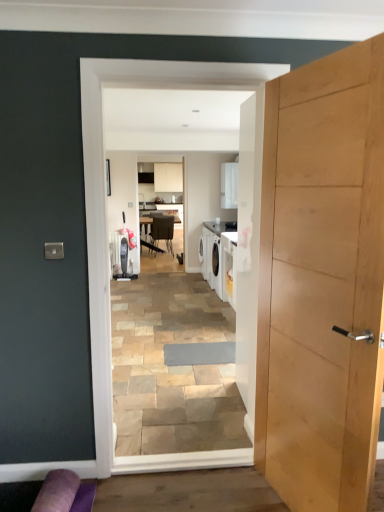
Question: From their relative heights in the image, would you say metallic silver chair at center is taller or shorter than white glossy laundry machine at center?

Choices:
 (A) short
 (B) tall

Answer: (A)

Question: Looking at their shapes, would you say metallic silver chair at center is wider or thinner than white glossy laundry machine at center?

Choices:
 (A) wide
 (B) thin

Answer: (A)

Question: Which object is positioned closest to the metallic silver chair at center?

Choices:
 (A) light wood door at right
 (B) white glossy laundry machine at center
 (C) purple fabric couch at lower left

Answer: (B)

Question: Which of these objects is positioned closest to the purple fabric couch at lower left?

Choices:
 (A) white glossy laundry machine at center
 (B) metallic silver chair at center
 (C) light wood door at right

Answer: (A)